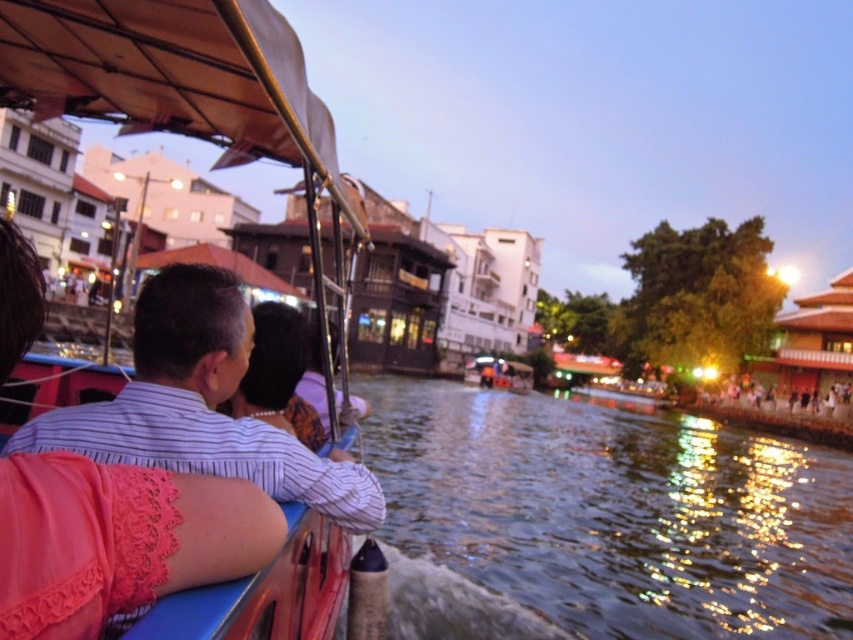
Question: Does dark water at center have a smaller size compared to wooden boat at center?

Choices:
 (A) no
 (B) yes

Answer: (A)

Question: Which of the following is the closest to the observer?

Choices:
 (A) striped fabric shirt at center
 (B) matte black boat at right
 (C) dark water at center

Answer: (A)

Question: Which point appears farthest from the camera in this image?

Choices:
 (A) (279, 156)
 (B) (263, 390)
 (C) (639, 627)
 (D) (808, 397)

Answer: (D)

Question: Which point is closer to the camera?

Choices:
 (A) dark water at center
 (B) striped fabric shirt at center
 (C) wooden boat at center

Answer: (B)

Question: Is dark water at center to the left of wooden boat at center from the viewer's perspective?

Choices:
 (A) yes
 (B) no

Answer: (B)

Question: Is dark water at center further to camera compared to matte black boat at right?

Choices:
 (A) yes
 (B) no

Answer: (B)